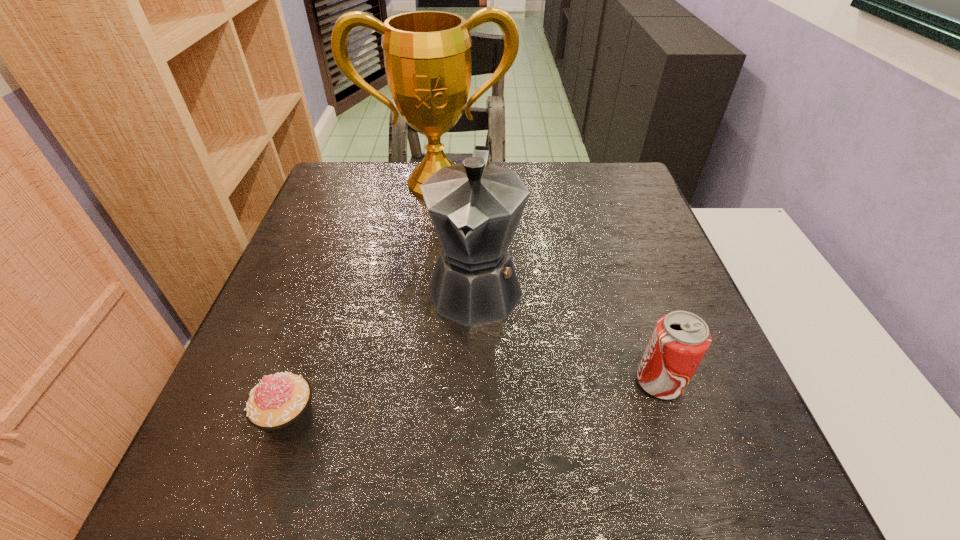
You are a GUI agent. You are given a task and a screenshot of the screen. Output one action in this format:
    pyautogui.click(x=<x>, y=<y>)
    Task: Click on the vacant space on the desktop that is between the shortest object and the third tallest object and is positioned on the front-facing side of the farthest object
    The image size is (960, 540).
    Given the screenshot: What is the action you would take?
    pyautogui.click(x=462, y=403)

You are a GUI agent. You are given a task and a screenshot of the screen. Output one action in this format:
    pyautogui.click(x=<x>, y=<y>)
    Task: Click on the free space on the desktop that is between the shortest object and the soda can and is positioned at the spout of the second farthest object
    The height and width of the screenshot is (540, 960).
    Given the screenshot: What is the action you would take?
    pyautogui.click(x=456, y=403)